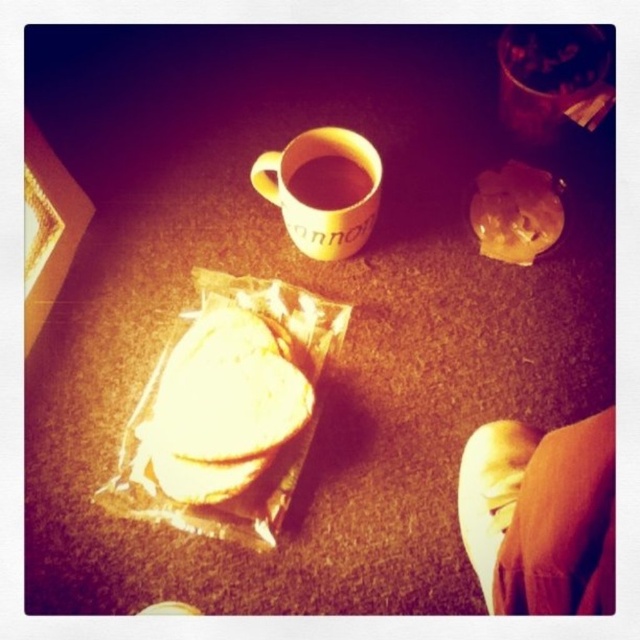
Where is `white paper sandwich at center`? This screenshot has height=640, width=640. white paper sandwich at center is located at coordinates (221, 408).

This screenshot has height=640, width=640. In order to click on white paper sandwich at center in this screenshot , I will do `click(221, 408)`.

At what (x,y) coordinates should I click in order to perform the action: click on white paper sandwich at center. Please return your answer as a coordinate pair (x, y). This screenshot has width=640, height=640. Looking at the image, I should click on (221, 408).

Can you confirm if yellow matte mug at center is taller than matte ceramic mug at upper center?

Yes.

Image resolution: width=640 pixels, height=640 pixels. Describe the element at coordinates (316, 209) in the screenshot. I see `yellow matte mug at center` at that location.

This screenshot has height=640, width=640. Describe the element at coordinates (316, 209) in the screenshot. I see `yellow matte mug at center` at that location.

Find the location of `yellow matte mug at center`. yellow matte mug at center is located at coordinates (316, 209).

Is point (141, 458) more distant than point (337, 227)?

No, (141, 458) is closer to viewer.

How much distance is there between white paper sandwich at center and yellow matte mug at center?

The distance of white paper sandwich at center from yellow matte mug at center is 10.28 inches.

Who is more forward, (214,493) or (285,218)?

Point (214,493) is in front.

Where is `white paper sandwich at center`? The height and width of the screenshot is (640, 640). white paper sandwich at center is located at coordinates (221, 408).